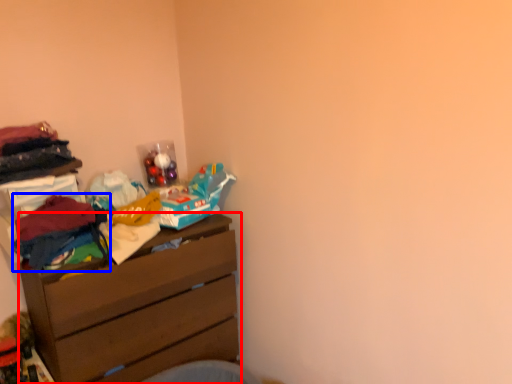
Question: Which point is further to the camera, chest of drawers (highlighted by a red box) or clothing (highlighted by a blue box)?

Choices:
 (A) chest of drawers
 (B) clothing

Answer: (A)